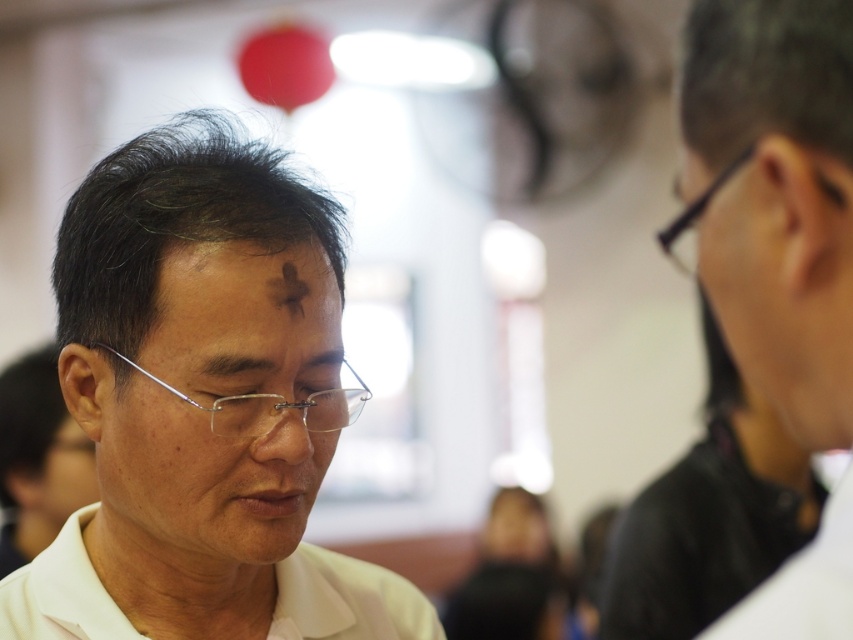
You are a photographer adjusting your camera settings to capture the man with the cross on his forehead. The camera has a focus point at point [746,106]. If the focus point needs to be within 50 centimeters of the subject to achieve sharp focus, will the current focus point distance work?

The point [746,106] is 50.32 centimeters from the camera, which is slightly beyond the 50 centimeter threshold. Therefore, the focus point is too far to achieve sharp focus on the man with the cross on his forehead.

You are standing in a religious setting and want to take a photo of the man with the cross on his forehead. The camera you have can only focus on objects within 90 centimeters. Is the point at coordinates point (x=265, y=320) within the camera focus range?

The point at coordinates point (x=265, y=320) is 89.02 centimeters away from the camera, which is within the 90 centimeter focus range. Therefore, the camera can focus on that point.

You are organizing a charity event and need to place a donation box between the matte black shirt at right and the white matte dress shirt at lower left. The donation box is 1.2 meters wide. Can it fit between them?

The matte black shirt at right is smaller than the white matte dress shirt at lower left, but the distance between them isn